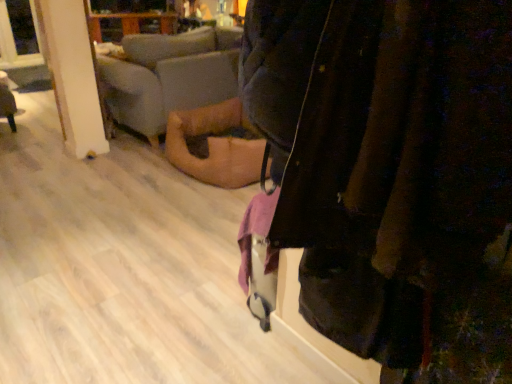
Question: Can you confirm if velvet dark jacket at center is bigger than soft beige fabric couch at center?

Choices:
 (A) yes
 (B) no

Answer: (B)

Question: Is the surface of velvet dark jacket at center in direct contact with soft beige fabric couch at center?

Choices:
 (A) yes
 (B) no

Answer: (B)

Question: Is velvet dark jacket at center thinner than soft beige fabric couch at center?

Choices:
 (A) no
 (B) yes

Answer: (B)

Question: Does velvet dark jacket at center have a smaller size compared to soft beige fabric couch at center?

Choices:
 (A) yes
 (B) no

Answer: (A)

Question: Is velvet dark jacket at center further to the viewer compared to soft beige fabric couch at center?

Choices:
 (A) yes
 (B) no

Answer: (B)

Question: Does point [2, 105] appear closer or farther from the camera than point [442, 248]?

Choices:
 (A) farther
 (B) closer

Answer: (A)

Question: From the image's perspective, is wooden floor at lower left located above or below velvet dark jacket at center?

Choices:
 (A) below
 (B) above

Answer: (B)

Question: Is wooden floor at lower left bigger or smaller than velvet dark jacket at center?

Choices:
 (A) big
 (B) small

Answer: (B)

Question: From a real-world perspective, relative to velvet dark jacket at center, is wooden floor at lower left vertically above or below?

Choices:
 (A) above
 (B) below

Answer: (B)

Question: In the image, is velvet dark jacket at center positioned in front of or behind transparent glass window at upper left?

Choices:
 (A) behind
 (B) front

Answer: (B)

Question: In terms of size, does velvet dark jacket at center appear bigger or smaller than transparent glass window at upper left?

Choices:
 (A) big
 (B) small

Answer: (A)

Question: Does point (485, 342) appear closer or farther from the camera than point (19, 18)?

Choices:
 (A) farther
 (B) closer

Answer: (B)

Question: Visually, is velvet dark jacket at center positioned to the left or to the right of transparent glass window at upper left?

Choices:
 (A) right
 (B) left

Answer: (A)

Question: In terms of height, does velvet dark jacket at center look taller or shorter compared to wooden floor at lower left?

Choices:
 (A) short
 (B) tall

Answer: (B)

Question: Is point (452, 210) positioned closer to the camera than point (8, 86)?

Choices:
 (A) closer
 (B) farther

Answer: (A)